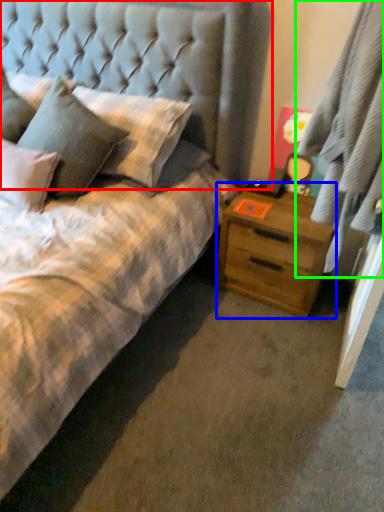
Question: Which object is the closest to the headboard (highlighted by a red box)? Choose among these: nightstand (highlighted by a blue box) or curtain (highlighted by a green box).

Choices:
 (A) nightstand
 (B) curtain

Answer: (A)